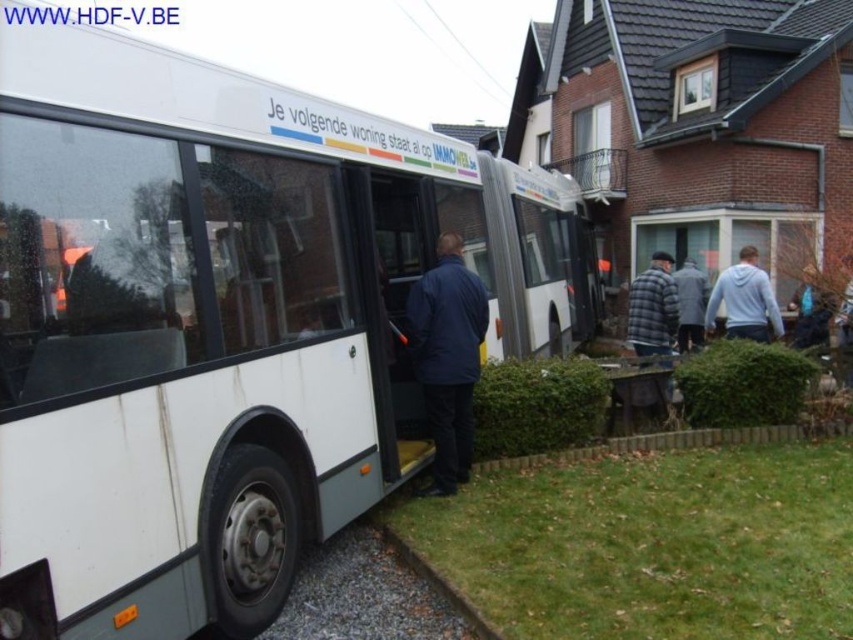
Does point (778, 317) lie behind point (659, 372)?

Yes, point (778, 317) is farther from viewer.

Who is positioned more to the right, light gray hoodie at right or wooden bench at lower right?

light gray hoodie at right is more to the right.

The image size is (853, 640). I want to click on light gray hoodie at right, so click(746, 300).

Find the location of `light gray hoodie at right`. light gray hoodie at right is located at coordinates (746, 300).

Which is behind, point (637, 307) or point (611, 403)?

Positioned behind is point (637, 307).

Between plaid fabric jacket at center and wooden bench at lower right, which one has less height?

wooden bench at lower right is shorter.

The image size is (853, 640). What are the coordinates of `plaid fabric jacket at center` in the screenshot? It's located at (653, 308).

Find the location of a particular element. The width and height of the screenshot is (853, 640). plaid fabric jacket at center is located at coordinates (653, 308).

Which is more to the right, dark blue jacket at center or wooden bench at lower right?

From the viewer's perspective, wooden bench at lower right appears more on the right side.

Between point (434, 349) and point (628, 390), which one is positioned behind?

The point (628, 390) is behind.

Identify the location of dark blue jacket at center. The height and width of the screenshot is (640, 853). (447, 356).